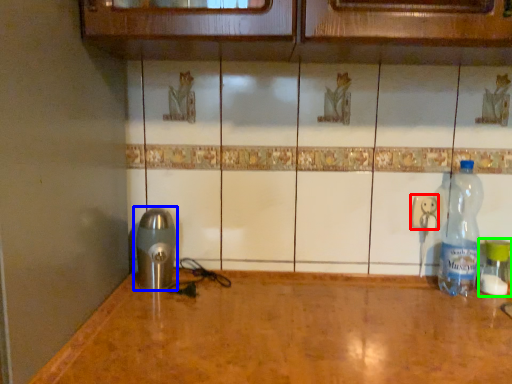
Question: Based on their relative distances, which object is nearer to electric outlet (highlighted by a red box)? Choose from appliance (highlighted by a blue box) and bottle (highlighted by a green box).

Choices:
 (A) appliance
 (B) bottle

Answer: (B)